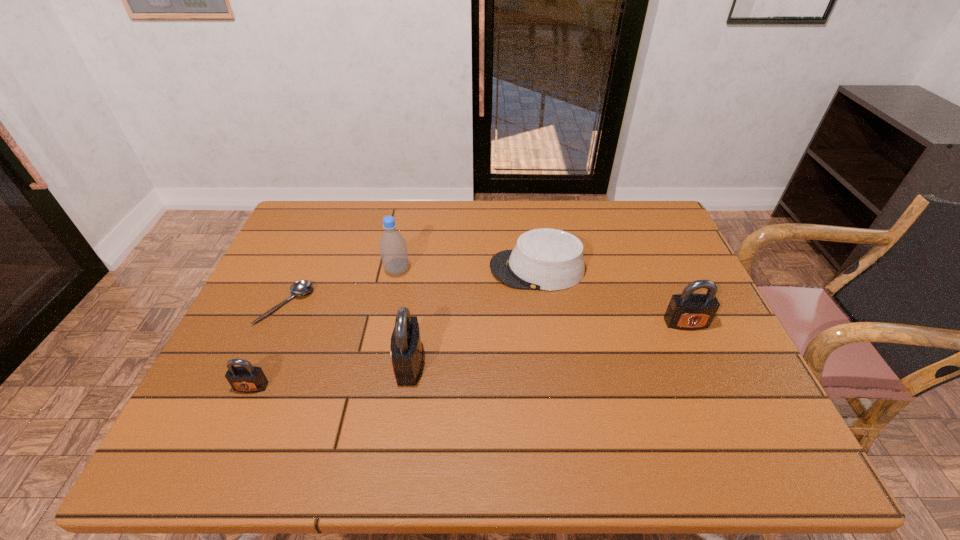
To make them evenly spaced by inserting another padlock among them, please locate a free space for this new padlock. Please provide its 2D coordinates. Your answer should be formatted as a tuple, i.e. [(x, y)], where the tuple contains the x and y coordinates of a point satisfying the conditions above.

[(553, 342)]